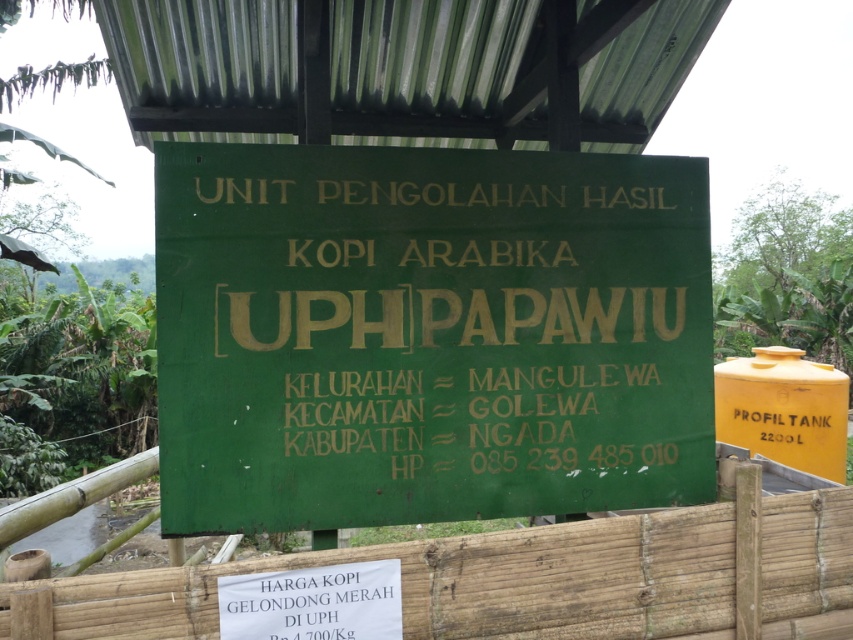
How much distance is there between green matte signboard at center and white paper sign at lower center?

28.41 inches

Who is shorter, green matte signboard at center or white paper sign at lower center?

Standing shorter between the two is white paper sign at lower center.

You are a GUI agent. You are given a task and a screenshot of the screen. Output one action in this format:
    pyautogui.click(x=<x>, y=<y>)
    Task: Click on the green matte signboard at center
    The height and width of the screenshot is (640, 853).
    Given the screenshot: What is the action you would take?
    pyautogui.click(x=427, y=333)

Where is `green matte signboard at center`? The width and height of the screenshot is (853, 640). green matte signboard at center is located at coordinates (427, 333).

Is wooden at center closer to the viewer compared to yellow matte tank at right?

Yes.

Which is in front, point (223, 582) or point (715, 372)?

Point (223, 582) is more forward.

Does point (714, 630) come in front of point (793, 442)?

That is True.

Find the location of a particular element. Image resolution: width=853 pixels, height=640 pixels. wooden at center is located at coordinates (520, 579).

How far apart are wooden at center and white paper sign at lower center?

A distance of 6.89 inches exists between wooden at center and white paper sign at lower center.

Between point (743, 621) and point (329, 566), which one is positioned in front?

Positioned in front is point (329, 566).

Where is `wooden at center`? wooden at center is located at coordinates [520, 579].